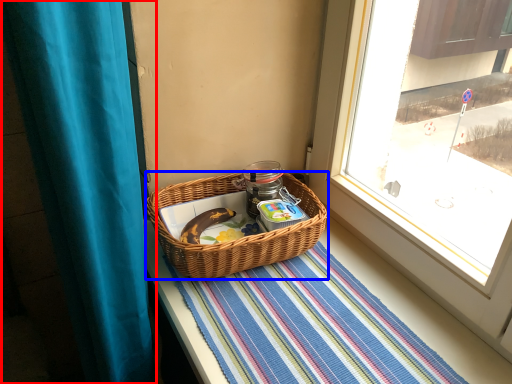
Question: Which of the following is the farthest to the observer, curtain (highlighted by a red box) or picnic basket (highlighted by a blue box)?

Choices:
 (A) curtain
 (B) picnic basket

Answer: (B)